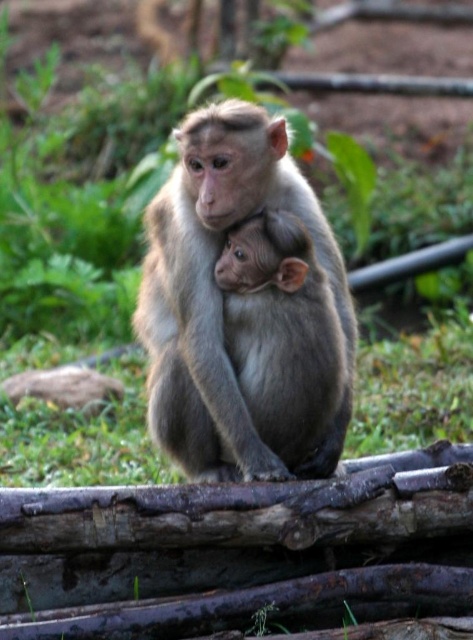
You are a wildlife photographer observing two monkeys in the scene. You need to position your camera such that both the light brown fur monkey at center and the gray furry monkey at center are in frame. Based on their positions, which monkey should you focus on first to ensure the camera captures them both?

The light brown fur monkey at center is to the left of the gray furry monkey at center. To capture both in the frame, focus on the light brown fur monkey at center first as it is positioned to the left, allowing the gray furry monkey at center to be included in the right side of the frame.

Based on the scene description, which monkey is taller between the light brown fur monkey at center and the gray furry monkey at center?

The light brown fur monkey at center is much taller than the gray furry monkey at center.

You are standing at the point marked by the coordinates point [244,204]. You want to throw a banana to the adult monkey sitting on the weathered, rusted metal structure. Will the banana reach the adult monkey if you throw it 3 meters forward?

The distance between you and the viewer is 3.14 meters. Since you can only throw the banana 3 meters forward, it won t reach the adult monkey.